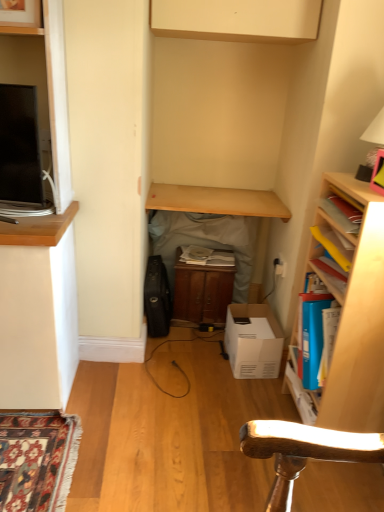
Where is `free location in front of white cardboard box at center`? Image resolution: width=384 pixels, height=512 pixels. free location in front of white cardboard box at center is located at coordinates (248, 392).